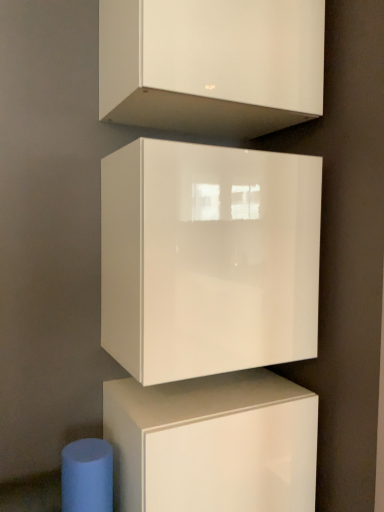
Question: In the image, is glossy white cabinet at center, which appears as the 3th cabinetry when viewed from the top, positioned in front of or behind white glossy cabinet at upper center, the 1th cabinetry viewed from the top?

Choices:
 (A) front
 (B) behind

Answer: (B)

Question: In the image, is glossy white cabinet at center, acting as the 1th cabinetry starting from the bottom, on the left side or the right side of white glossy cabinet at upper center, the 1th cabinetry viewed from the top?

Choices:
 (A) left
 (B) right

Answer: (A)

Question: Which is nearer to the glossy white cabinet at center, acting as the 1th cabinetry starting from the bottom?

Choices:
 (A) white glossy cabinet at upper center, the 1th cabinetry viewed from the top
 (B) glossy white cube at center, positioned as the 2th cabinetry in bottom-to-top order

Answer: (B)

Question: Estimate the real-world distances between objects in this image. Which object is closer to the glossy white cabinet at center, acting as the 1th cabinetry starting from the bottom?

Choices:
 (A) glossy white cube at center, which is the second cabinetry in top-to-bottom order
 (B) white glossy cabinet at upper center, the 1th cabinetry viewed from the top

Answer: (A)